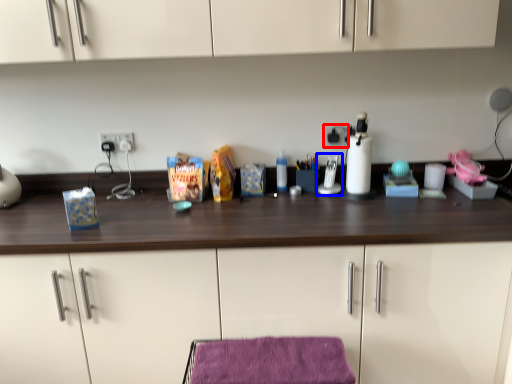
Question: Which of the following is the closest to the observer, electric outlet (highlighted by a red box) or appliance (highlighted by a blue box)?

Choices:
 (A) electric outlet
 (B) appliance

Answer: (B)